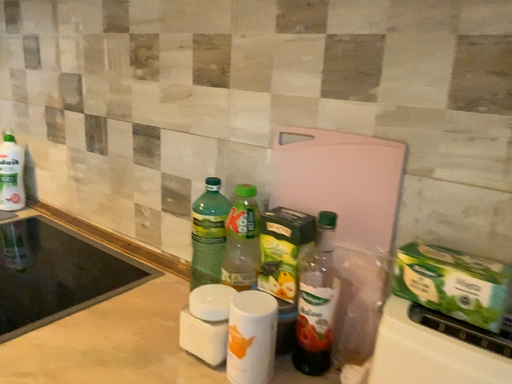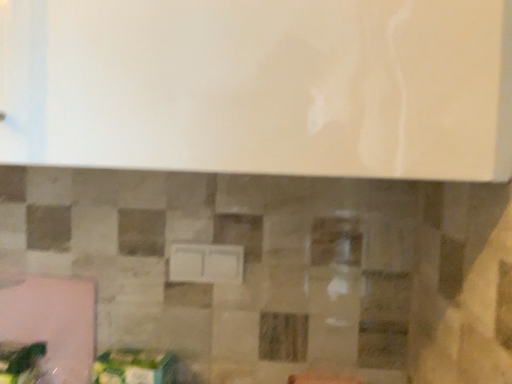
Question: How did the camera likely rotate when shooting the video?

Choices:
 (A) rotated upward
 (B) rotated downward

Answer: (A)